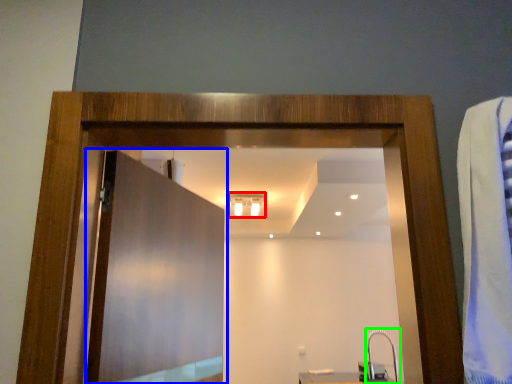
Question: Which object is positioned farthest from light fixture (highlighted by a red box)? Select from door (highlighted by a blue box) and faucet (highlighted by a green box).

Choices:
 (A) door
 (B) faucet

Answer: (A)